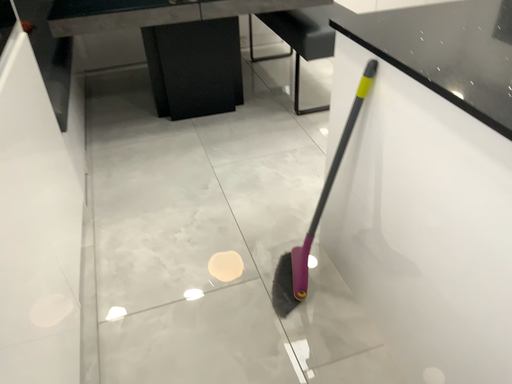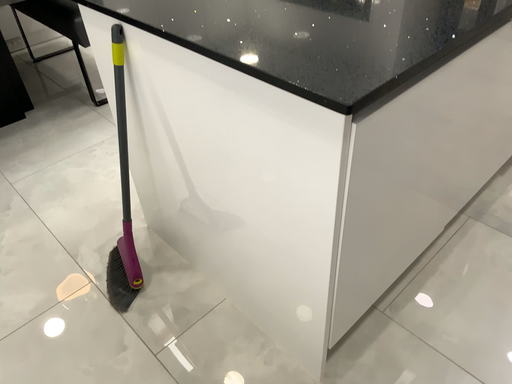
Question: Which way did the camera rotate in the video?

Choices:
 (A) rotated left
 (B) rotated right

Answer: (B)